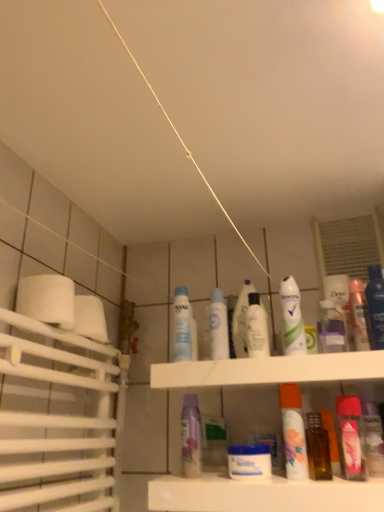
Question: Does point (327, 315) appear closer or farther from the camera than point (198, 468)?

Choices:
 (A) farther
 (B) closer

Answer: (A)

Question: From a real-world perspective, is translucent plastic spray bottle at upper center above or below purple matte mouthwash at center, the 8th mouthwash from the right?

Choices:
 (A) below
 (B) above

Answer: (B)

Question: Which object is positioned closest to the white glossy mouthwash at center, marked as the seventh mouthwash in a right-to-left arrangement?

Choices:
 (A) transparent plastic mouthwash at center, which is the 9th mouthwash in right-to-left order
 (B) translucent plastic bottle at center
 (C) white glossy jar at center, which ranks as the 6th mouthwash in right-to-left order
 (D) white matte toilet paper at left
 (E) white glossy mouthwash at center, the fifth mouthwash in the left-to-right sequence

Answer: (B)

Question: Considering the real-world distances, which object is farthest from the translucent plastic bottle at center?

Choices:
 (A) translucent orange spray can at center, acting as the 6th mouthwash starting from the left
 (B) transparent plastic mouthwash at center, the first mouthwash viewed from the left
 (C) purple matte mouthwash at center, the 8th mouthwash from the right
 (D) white plastic shelf at center
 (E) white glossy mouthwash at center, which ranks as the 3th mouthwash in left-to-right order

Answer: (C)